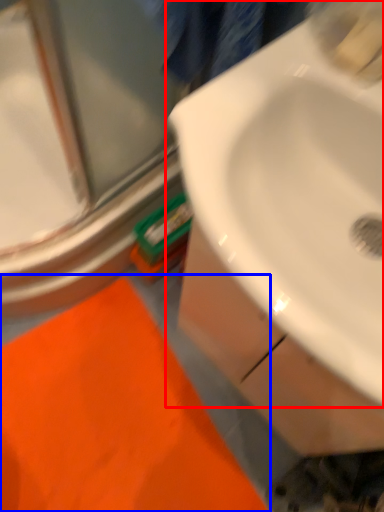
Question: Which object is further to the camera taking this photo, sink (highlighted by a red box) or bath mat (highlighted by a blue box)?

Choices:
 (A) sink
 (B) bath mat

Answer: (B)